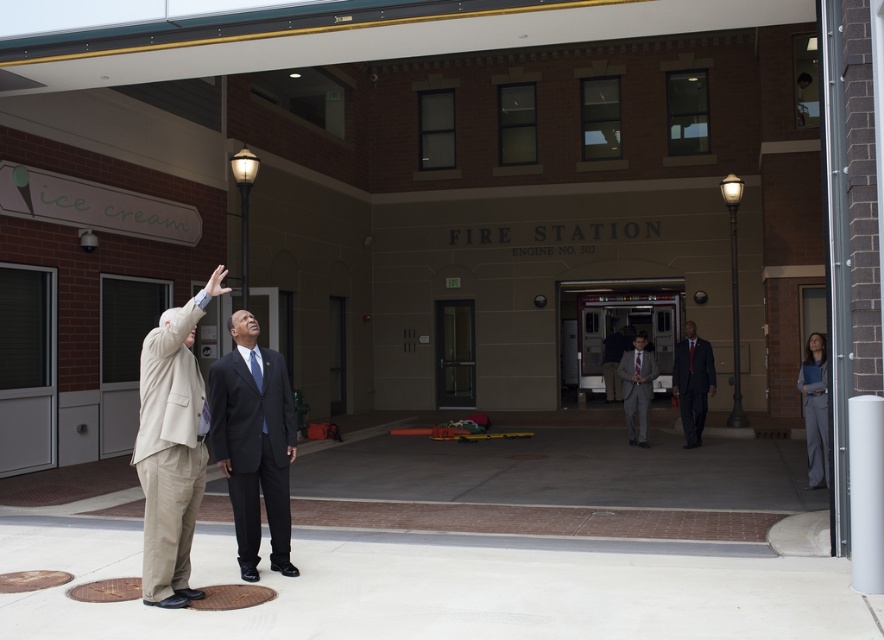
You are a photographer standing at the entrance of the fire station. You want to take a photo of the beige fabric suit at lower left and the black matte suit at center. Can you fit both subjects in the frame of your camera which has a maximum width of 20 inches?

The distance between the beige fabric suit at lower left and the black matte suit at center is 20.87 inches, which exceeds the camera frame width of 20 inches. Therefore, both subjects cannot fit within the frame simultaneously.